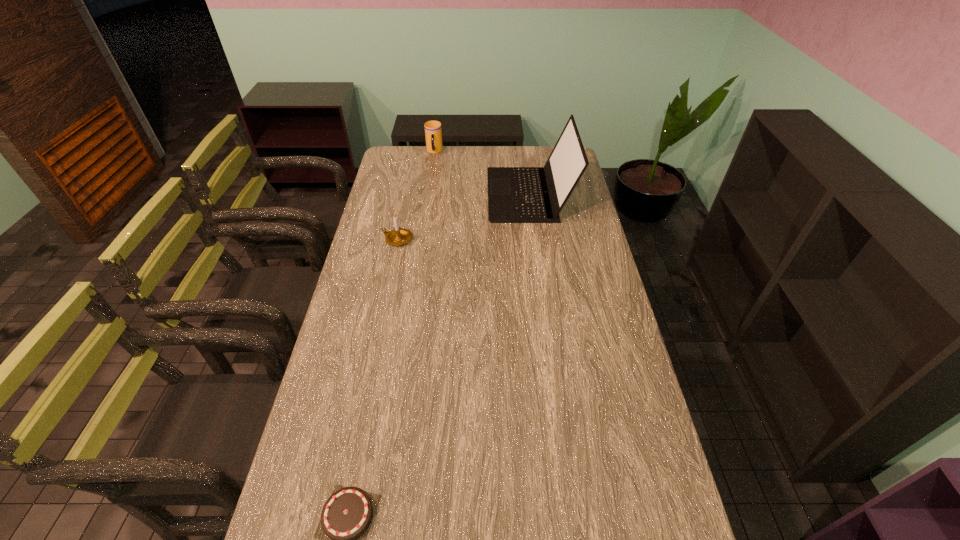
Point out which object is positioned as the second nearest to the candle holder. Please provide its 2D coordinates. Your answer should be formatted as a tuple, i.e. [(x, y)], where the tuple contains the x and y coordinates of a point satisfying the conditions above.

[(433, 132)]

Identify which object is the nearest to the shortest object. Please provide its 2D coordinates. Your answer should be formatted as a tuple, i.e. [(x, y)], where the tuple contains the x and y coordinates of a point satisfying the conditions above.

[(398, 236)]